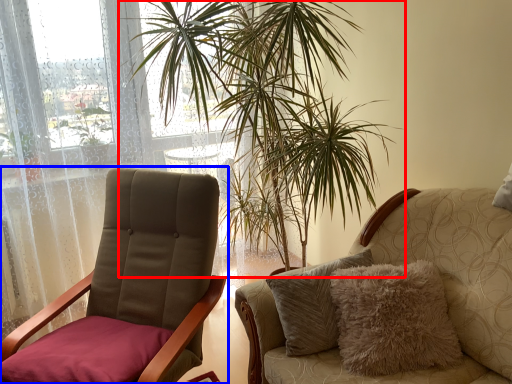
Question: Among these objects, which one is farthest to the camera, houseplant (highlighted by a red box) or chair (highlighted by a blue box)?

Choices:
 (A) houseplant
 (B) chair

Answer: (A)